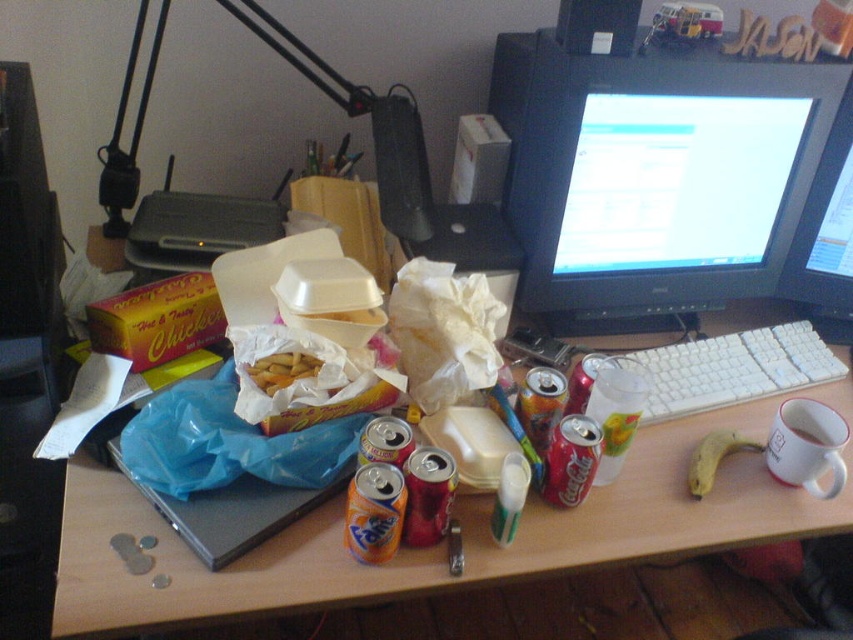
You are organizing your desk and want to move the black plastic monitor at upper right and the black glossy monitor at center closer to the edge. Which monitor should you move first to make space for a new keyboard?

The black plastic monitor at upper right should be moved first because it is positioned on the left side of the black glossy monitor at center, so moving it first would allow more space to reposition the other monitor and create room for the keyboard.

You are standing in front of a wooden desk at center. If you want to place a 12 inch long book on the desk, will it fit entirely on the desk surface?

The wooden desk at center is positioned 28.11 inches away from the viewer, but this distance does not indicate the desk surface size. The question about the book fitting cannot be determined solely based on the provided information.